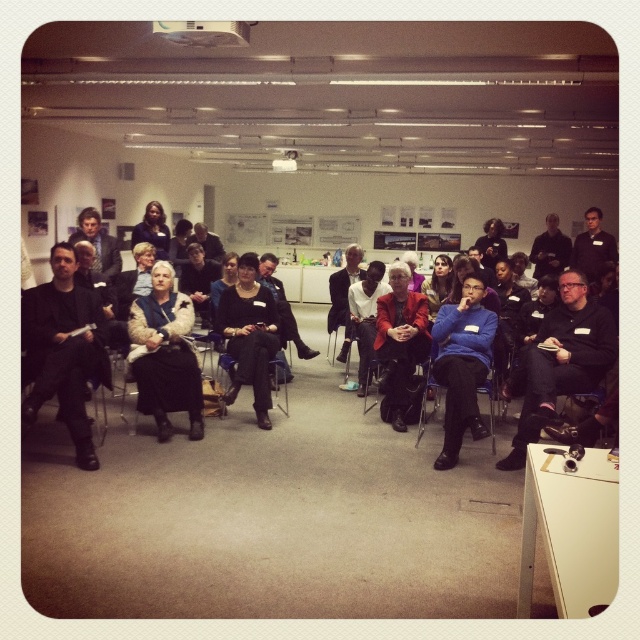
Question: Is matte black jacket at left to the right of blue matte sweater at center from the viewer's perspective?

Choices:
 (A) yes
 (B) no

Answer: (B)

Question: Is velvet beige dress at center further to camera compared to matte red jacket at center?

Choices:
 (A) no
 (B) yes

Answer: (A)

Question: Which point is farther to the camera?

Choices:
 (A) (394, 397)
 (B) (81, 326)

Answer: (A)

Question: Which object is positioned farthest from the velvet beige dress at center?

Choices:
 (A) blue matte sweater at center
 (B) black fabric dress at center

Answer: (A)

Question: Estimate the real-world distances between objects in this image. Which object is closer to the matte black jacket at left?

Choices:
 (A) black fabric chair at center
 (B) black fabric jacket at center
 (C) blue matte sweater at center

Answer: (A)

Question: Does black fabric jacket at center have a larger size compared to matte red jacket at center?

Choices:
 (A) no
 (B) yes

Answer: (B)